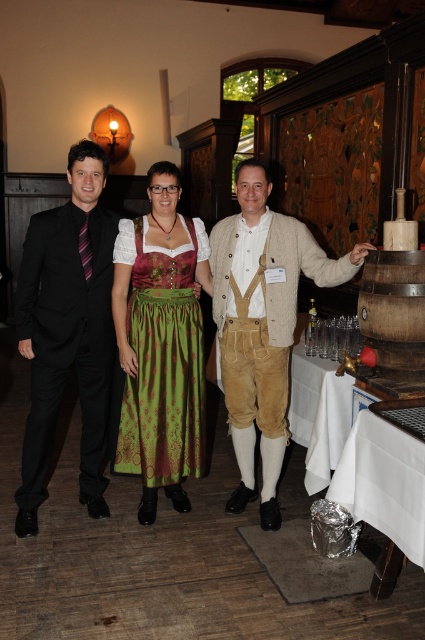
Question: Which is farther from the white cloth at lower right?

Choices:
 (A) green textured dirndl at center
 (B) knitted beige sweater at center
 (C) green satin dirndl at center
 (D) white cloth at right

Answer: (A)

Question: Is green textured dirndl at center to the left of white cloth at lower right from the viewer's perspective?

Choices:
 (A) no
 (B) yes

Answer: (B)

Question: Where is white cloth at lower right located in relation to white cloth at right in the image?

Choices:
 (A) left
 (B) right

Answer: (B)

Question: Among these objects, which one is nearest to the camera?

Choices:
 (A) white cloth at lower right
 (B) black satin suit at left
 (C) green satin dirndl at center
 (D) white cloth at right

Answer: (A)

Question: Does black satin suit at left have a larger size compared to white cloth at right?

Choices:
 (A) yes
 (B) no

Answer: (A)

Question: Which point is closer to the camera taking this photo?

Choices:
 (A) pos(266,356)
 (B) pos(153,224)

Answer: (B)